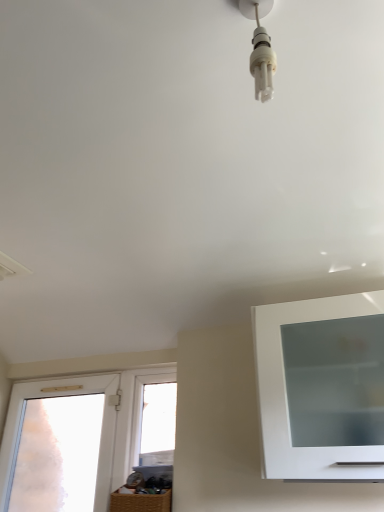
Question: Can you confirm if white plastic light bulb at upper center is taller than transparent glass window at center, the 1th window in the right-to-left sequence?

Choices:
 (A) no
 (B) yes

Answer: (A)

Question: Is white plastic light bulb at upper center facing away from transparent glass window at center, which ranks as the 2th window in left-to-right order?

Choices:
 (A) yes
 (B) no

Answer: (B)

Question: From a real-world perspective, is white plastic light bulb at upper center located higher than transparent glass window at center, the 1th window in the right-to-left sequence?

Choices:
 (A) no
 (B) yes

Answer: (B)

Question: Does white plastic light bulb at upper center come behind transparent glass window at center, the 1th window in the right-to-left sequence?

Choices:
 (A) no
 (B) yes

Answer: (A)

Question: Does white plastic light bulb at upper center appear on the right side of transparent glass window at center, the 1th window in the right-to-left sequence?

Choices:
 (A) no
 (B) yes

Answer: (B)

Question: From the image's perspective, is white plastic light bulb at upper center above transparent glass window at center, which ranks as the 2th window in left-to-right order?

Choices:
 (A) no
 (B) yes

Answer: (B)

Question: Would you say transparent glass window at center, the 1th window in the right-to-left sequence, contains white plastic light bulb at upper center?

Choices:
 (A) yes
 (B) no

Answer: (B)

Question: Are transparent glass window at center, the 1th window in the right-to-left sequence, and white plastic light bulb at upper center making contact?

Choices:
 (A) no
 (B) yes

Answer: (A)

Question: Does transparent glass window at center, the 1th window in the right-to-left sequence, have a larger size compared to white plastic light bulb at upper center?

Choices:
 (A) yes
 (B) no

Answer: (A)

Question: Is transparent glass window at center, which ranks as the 2th window in left-to-right order, in front of white plastic light bulb at upper center?

Choices:
 (A) yes
 (B) no

Answer: (B)

Question: Considering the relative positions of transparent glass window at center, which ranks as the 2th window in left-to-right order, and white plastic light bulb at upper center in the image provided, is transparent glass window at center, which ranks as the 2th window in left-to-right order, to the right of white plastic light bulb at upper center from the viewer's perspective?

Choices:
 (A) yes
 (B) no

Answer: (B)

Question: Is transparent glass window at center, the 1th window in the right-to-left sequence, positioned far away from white plastic light bulb at upper center?

Choices:
 (A) no
 (B) yes

Answer: (B)

Question: From a real-world perspective, is transparent frosted glass door at left, the first window in the left-to-right sequence, positioned under white plastic light bulb at upper center based on gravity?

Choices:
 (A) no
 (B) yes

Answer: (B)